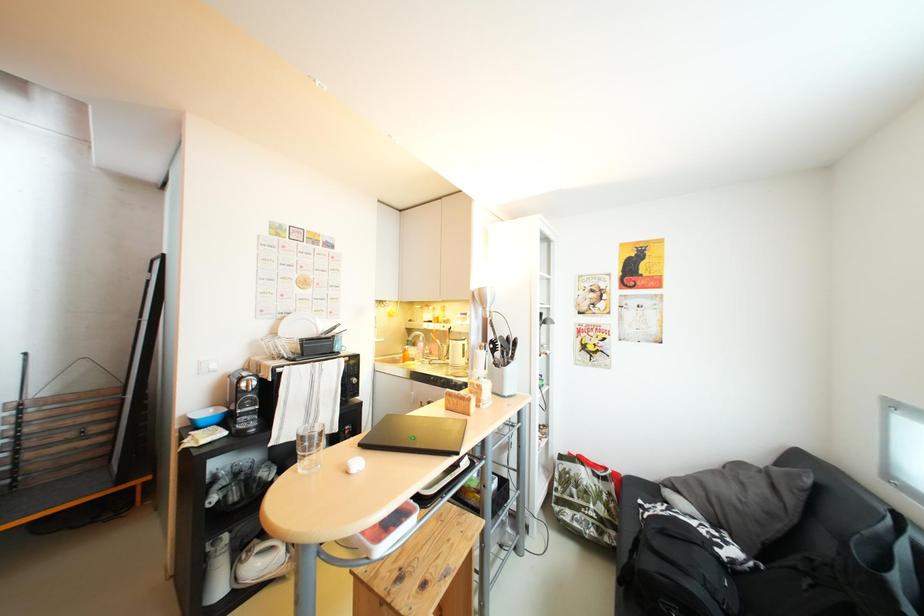
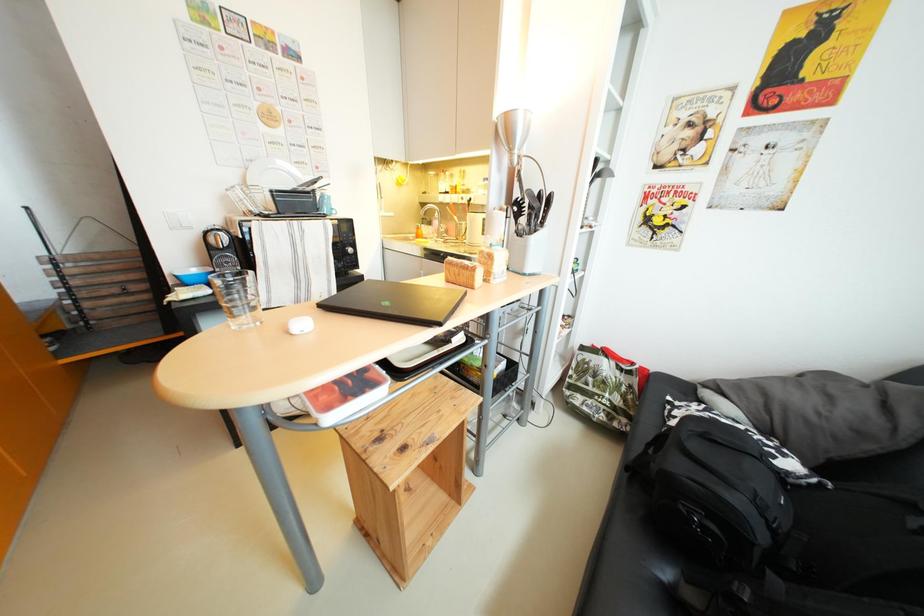
Question: Which direction would the cameraman need to move to produce the second image? Reply with the corresponding letter.

Choices:
 (A) Left
 (B) Right
 (C) Forward
 (D) Backward

Answer: (C)